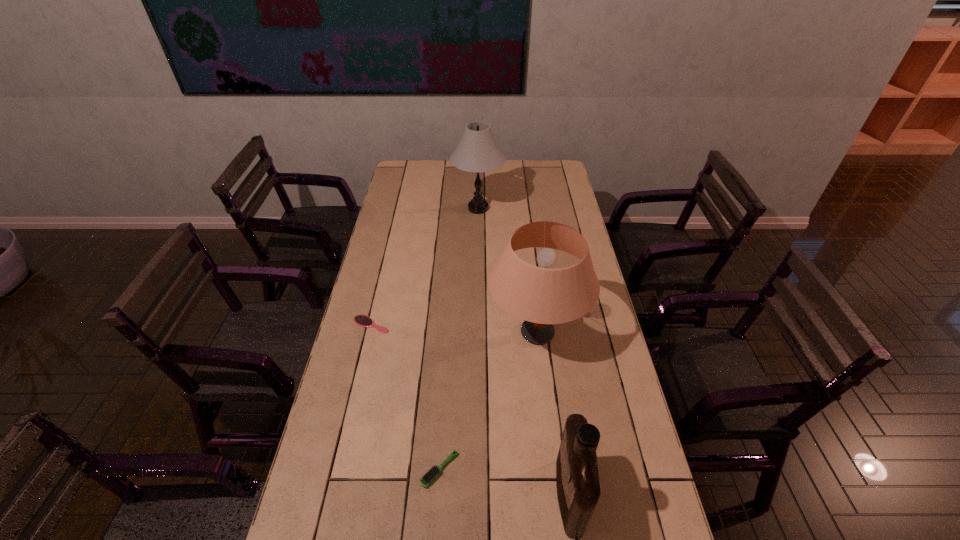
The width and height of the screenshot is (960, 540). Find the location of `vacant position located on the front-facing side of the lampshade`. vacant position located on the front-facing side of the lampshade is located at coordinates (426, 333).

Find the location of a particular element. This screenshot has width=960, height=540. free space located on the label side of the third tallest object is located at coordinates (413, 496).

Where is `vacant position located on the label side of the third tallest object`? The height and width of the screenshot is (540, 960). vacant position located on the label side of the third tallest object is located at coordinates (428, 496).

This screenshot has height=540, width=960. I want to click on free space located 0.080m on the label side of the third tallest object, so click(x=526, y=496).

The image size is (960, 540). I want to click on free space located 0.380m on the right of the second shortest object, so click(600, 470).

Where is `vacant space located on the back of the leftmost object`? vacant space located on the back of the leftmost object is located at coordinates (376, 303).

Locate an element on the screen. The image size is (960, 540). object that is at the left edge is located at coordinates (362, 320).

The image size is (960, 540). In order to click on object present at the right edge in this screenshot , I will do `click(542, 296)`.

The height and width of the screenshot is (540, 960). In the image, there is a desktop. In order to click on vacant space at the far edge in this screenshot , I will do `click(502, 168)`.

Find the location of a particular element. free location at the left edge of the desktop is located at coordinates (348, 525).